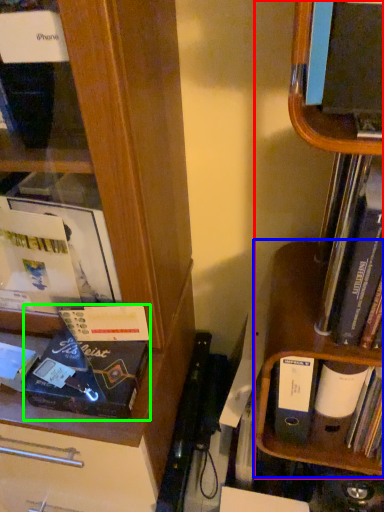
Question: Considering the real-world distances, which object is farthest from shelf (highlighted by a red box)? cabinet (highlighted by a blue box) or paperback book (highlighted by a green box)?

Choices:
 (A) cabinet
 (B) paperback book

Answer: (B)